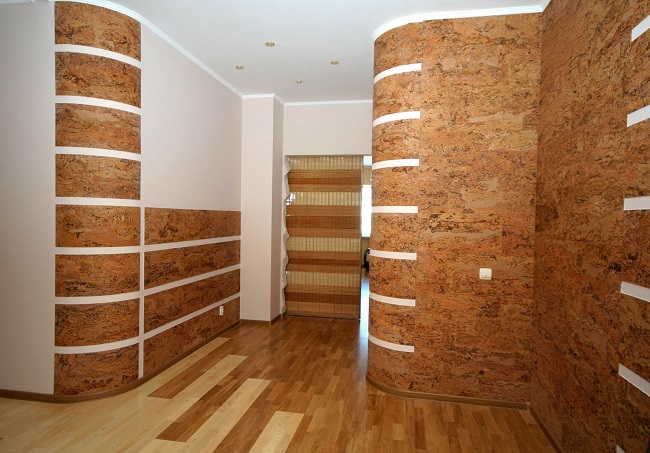
Where is `ceiling`? The height and width of the screenshot is (453, 650). ceiling is located at coordinates (327, 39).